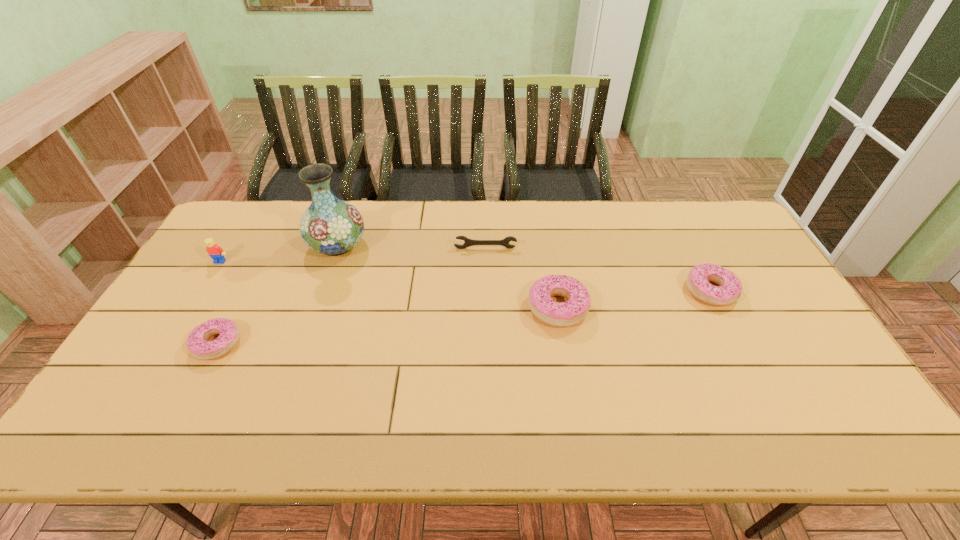
The image size is (960, 540). I want to click on free space between the fifth shortest object and the wrench, so click(x=352, y=255).

In order to click on free space between the second tallest object and the fourth object from left to right in this screenshot , I will do `click(352, 255)`.

This screenshot has width=960, height=540. Identify the location of free space that is in between the shortest doughnut and the tallest object. (277, 294).

At what (x,y) coordinates should I click in order to perform the action: click on empty location between the second tallest object and the second doughnut from right to left. Please return your answer as a coordinate pair (x, y). Looking at the image, I should click on (389, 285).

Locate an element on the screen. This screenshot has height=540, width=960. empty space between the second object from left to right and the second doughnut from left to right is located at coordinates (388, 326).

Find the location of a particular element. Image resolution: width=960 pixels, height=540 pixels. free spot between the third object from left to right and the rightmost object is located at coordinates (524, 268).

Find the location of a particular element. The image size is (960, 540). free space between the fourth object from right to left and the shortest doughnut is located at coordinates (277, 294).

You are a GUI agent. You are given a task and a screenshot of the screen. Output one action in this format:
    pyautogui.click(x=<x>, y=<y>)
    Task: Click on the empty space between the wrench and the second doughnut from left to right
    This screenshot has width=960, height=540.
    Given the screenshot: What is the action you would take?
    pyautogui.click(x=521, y=278)

Identify the location of object that is the second closest to the fifth object from left to right. This screenshot has height=540, width=960. (730, 287).

I want to click on the fourth closest object relative to the second doughnut from right to left, so click(197, 344).